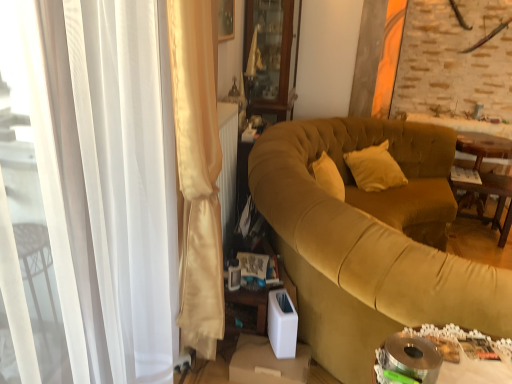
What do you see at coordinates (473, 371) in the screenshot? This screenshot has width=512, height=384. I see `metallic silver tray at lower right, marked as the third table in a right-to-left arrangement` at bounding box center [473, 371].

Measure the distance between point (265, 101) and camera.

Point (265, 101) and camera are 3.23 meters apart.

Find the location of `metallic silver tray at lower right, positioned as the first table in front-to-back order`. metallic silver tray at lower right, positioned as the first table in front-to-back order is located at coordinates (473, 371).

Can you confirm if metallic silver tray at lower right, which is the third table from back to front, is thinner than wooden cabinet at upper center?

Yes, metallic silver tray at lower right, which is the third table from back to front, is thinner than wooden cabinet at upper center.

Is metallic silver tray at lower right, which is the third table from back to front, taller or shorter than wooden cabinet at upper center?

Clearly, metallic silver tray at lower right, which is the third table from back to front, is shorter compared to wooden cabinet at upper center.

Locate an element on the screen. table lying in front of the wooden cabinet at upper center is located at coordinates [x=473, y=371].

Is wooden table at right, acting as the first table starting from the right, facing towards wooden table at right, which is the 2th table in right-to-left order?

Yes, wooden table at right, acting as the first table starting from the right, is facing wooden table at right, which is the 2th table in right-to-left order.

Between wooden table at right, the third table positioned from the left, and wooden table at right, marked as the 2th table in a front-to-back arrangement, which one has more height?

wooden table at right, the third table positioned from the left.

From the image's perspective, which object appears higher, wooden table at right, the third table in the front-to-back sequence, or wooden table at right, marked as the 2th table in a front-to-back arrangement?

From the image's view, wooden table at right, the third table in the front-to-back sequence, is above.

Which is more to the right, wooden table at right, the third table in the front-to-back sequence, or wooden table at right, positioned as the 2th table in back-to-front order?

wooden table at right, the third table in the front-to-back sequence.

Can you see metallic silver tray at lower right, marked as the third table in a right-to-left arrangement, touching satin white curtain at left?

metallic silver tray at lower right, marked as the third table in a right-to-left arrangement, and satin white curtain at left are clearly separated.

Which is farther, (377, 370) or (191, 25)?

The point (377, 370) is farther.

Considering the positions of objects metallic silver tray at lower right, which is the third table from back to front, and satin white curtain at left in the image provided, who is more to the left, metallic silver tray at lower right, which is the third table from back to front, or satin white curtain at left?

satin white curtain at left.

Is metallic silver tray at lower right, which is the third table from back to front, wider than satin white curtain at left?

In fact, metallic silver tray at lower right, which is the third table from back to front, might be narrower than satin white curtain at left.

How far apart are wooden cabinet at upper center and wooden table at right, arranged as the first table when viewed from the back?

A distance of 5.72 feet exists between wooden cabinet at upper center and wooden table at right, arranged as the first table when viewed from the back.

Which object is further away from the camera taking this photo, wooden cabinet at upper center or wooden table at right, the third table in the front-to-back sequence?

wooden table at right, the third table in the front-to-back sequence, is further from the camera.

Does wooden cabinet at upper center have a greater width compared to wooden table at right, arranged as the first table when viewed from the back?

No.

Is there a large distance between wooden cabinet at upper center and wooden table at right, acting as the first table starting from the right?

Yes, wooden cabinet at upper center and wooden table at right, acting as the first table starting from the right, are quite far apart.

Who is smaller, satin white curtain at left or metallic silver tray at lower right, positioned as the first table in front-to-back order?

metallic silver tray at lower right, positioned as the first table in front-to-back order, is smaller.

From the image's perspective, which is above, satin white curtain at left or metallic silver tray at lower right, positioned as the first table in front-to-back order?

satin white curtain at left appears higher in the image.

Is satin white curtain at left oriented towards metallic silver tray at lower right, marked as the third table in a right-to-left arrangement?

No, satin white curtain at left does not turn towards metallic silver tray at lower right, marked as the third table in a right-to-left arrangement.

Is wooden table at right, the third table in the front-to-back sequence, touching satin white curtain at left?

They are not placed beside each other.

The height and width of the screenshot is (384, 512). In order to click on the 2nd table directly beneath the satin white curtain at left (from a real-world perspective) in this screenshot , I will do `click(483, 146)`.

Which is in front, point (507, 141) or point (155, 79)?

Positioned in front is point (155, 79).

Is wooden table at right, acting as the first table starting from the right, smaller than satin white curtain at left?

Yes.

From a real-world perspective, which is physically above, wooden cabinet at upper center or satin white curtain at left?

wooden cabinet at upper center is physically above.

From the image's perspective, who appears lower, wooden cabinet at upper center or satin white curtain at left?

satin white curtain at left appears lower in the image.

Does wooden cabinet at upper center appear on the left side of satin white curtain at left?

No, wooden cabinet at upper center is not to the left of satin white curtain at left.

Is wooden cabinet at upper center positioned before satin white curtain at left?

No, it is not.

Where is `armoire above the metallic silver tray at lower right, marked as the third table in a right-to-left arrangement (from a real-world perspective)`? armoire above the metallic silver tray at lower right, marked as the third table in a right-to-left arrangement (from a real-world perspective) is located at coordinates [x=269, y=55].

Where is `table that appears below the wooden table at right, the third table positioned from the left (from a real-world perspective)`? table that appears below the wooden table at right, the third table positioned from the left (from a real-world perspective) is located at coordinates (489, 194).

Based on their spatial positions, is metallic silver tray at lower right, which is the third table from back to front, or wooden table at right, positioned as the 2th table in back-to-front order, closer to velvet mustard couch at center?

The object closer to velvet mustard couch at center is metallic silver tray at lower right, which is the third table from back to front.

When comparing their distances from wooden table at right, arranged as the first table when viewed from the back, does wooden table at right, marked as the 2th table in a front-to-back arrangement, or satin white curtain at left seem closer?

wooden table at right, marked as the 2th table in a front-to-back arrangement, is closer to wooden table at right, arranged as the first table when viewed from the back.

Based on their spatial positions, is velvet mustard couch at center or wooden cabinet at upper center closer to wooden table at right, marked as the 2th table in a front-to-back arrangement?

velvet mustard couch at center is closer to wooden table at right, marked as the 2th table in a front-to-back arrangement.

When comparing their distances from wooden table at right, positioned as the 2th table in back-to-front order, does satin white curtain at left or wooden table at right, arranged as the first table when viewed from the back, seem closer?

The object closer to wooden table at right, positioned as the 2th table in back-to-front order, is wooden table at right, arranged as the first table when viewed from the back.

From the picture: When comparing their distances from satin white curtain at left, does wooden table at right, which is the 2th table in right-to-left order, or wooden table at right, arranged as the first table when viewed from the back, seem further?

wooden table at right, arranged as the first table when viewed from the back.

Estimate the real-world distances between objects in this image. Which object is closer to metallic silver tray at lower right, positioned as the first table in front-to-back order, velvet mustard couch at center or wooden cabinet at upper center?

The object closer to metallic silver tray at lower right, positioned as the first table in front-to-back order, is velvet mustard couch at center.

Which object lies further to the anchor point velvet mustard couch at center, wooden table at right, the third table in the front-to-back sequence, or wooden cabinet at upper center?

wooden table at right, the third table in the front-to-back sequence, lies further to velvet mustard couch at center than the other object.

Considering their positions, is wooden table at right, arranged as the first table when viewed from the back, positioned closer to satin white curtain at left than wooden cabinet at upper center?

wooden cabinet at upper center is closer to satin white curtain at left.

You are a GUI agent. You are given a task and a screenshot of the screen. Output one action in this format:
    pyautogui.click(x=<x>, y=<y>)
    Task: Click on the table positioned between metallic silver tray at lower right, marked as the third table in a right-to-left arrangement, and wooden table at right, the third table positioned from the left, from near to far
    This screenshot has height=384, width=512.
    Given the screenshot: What is the action you would take?
    pyautogui.click(x=489, y=194)

The width and height of the screenshot is (512, 384). I want to click on studio couch between metallic silver tray at lower right, marked as the third table in a right-to-left arrangement, and wooden table at right, positioned as the 2th table in back-to-front order, along the z-axis, so click(x=371, y=240).

What are the coordinates of `table between satin white curtain at left and velvet mustard couch at center` in the screenshot? It's located at (473, 371).

Identify the location of studio couch positioned between satin white curtain at left and wooden table at right, acting as the first table starting from the right, from near to far. The width and height of the screenshot is (512, 384). (371, 240).